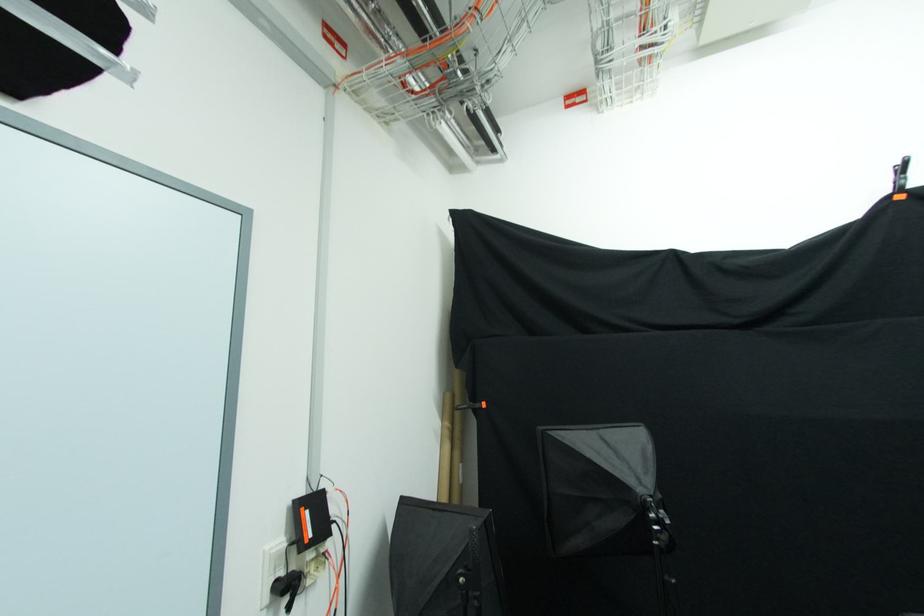
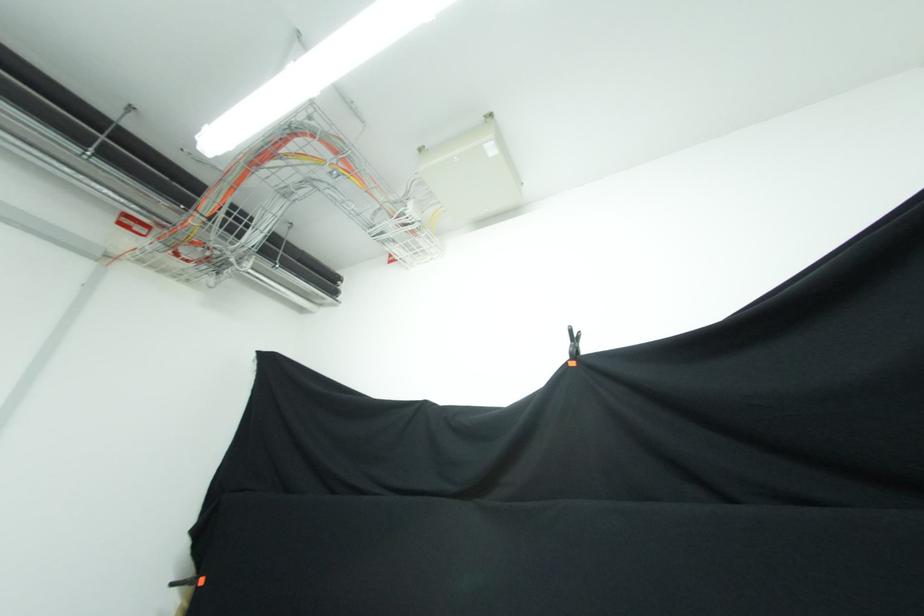
Question: The images are taken continuously from a first-person perspective. In which direction are you moving?

Choices:
 (A) Left
 (B) Right
 (C) Forward
 (D) Backward

Answer: (B)